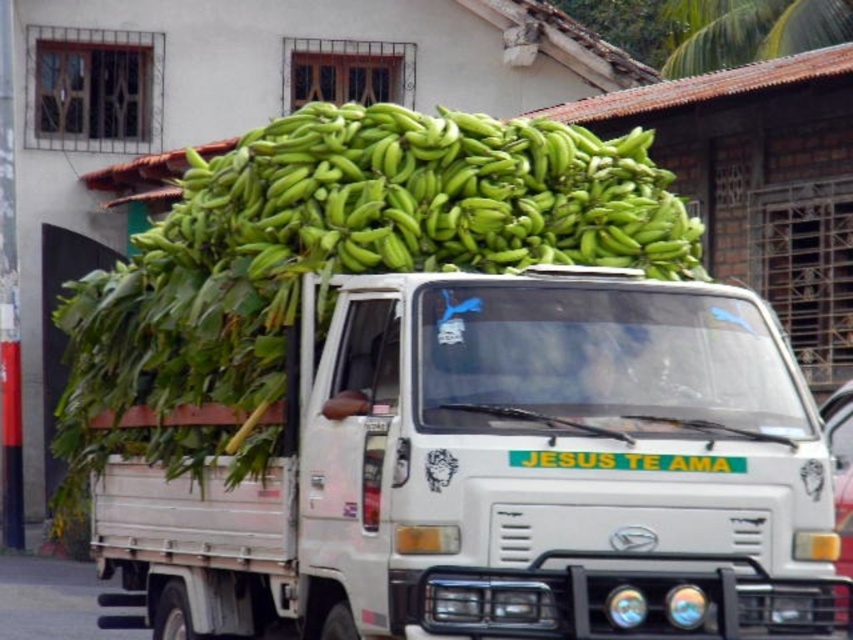
Is point (171, 536) closer to viewer compared to point (440, 124)?

That is False.

Which is in front, point (749, 520) or point (645, 244)?

Point (749, 520)

Who is more distant from viewer, (450, 444) or (426, 268)?

The point (426, 268) is behind.

You are a GUI agent. You are given a task and a screenshot of the screen. Output one action in this format:
    pyautogui.click(x=<x>, y=<y>)
    Task: Click on the white matte truck at center
    The image size is (853, 640).
    Given the screenshot: What is the action you would take?
    pyautogui.click(x=503, y=474)